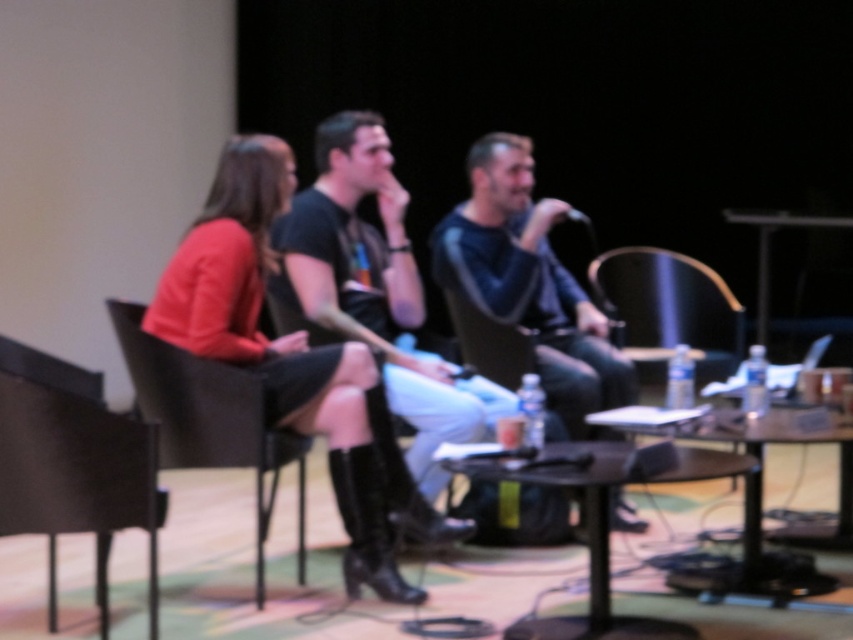
Based on the scene description, where is the wooden round table at center located in terms of its 2D coordinates?

The wooden round table at center is located at the 2D coordinates of point (759, 506).

You are organizing a small event and need to seat two guests. You have a black wicker chair at left and a wooden table at right available. Which object can accommodate a larger guest?

The black wicker chair at left has a larger size compared to the wooden table at right, so it can accommodate a larger guest.

You are an event organizer setting up a stage for a panel discussion. You have two items to place on the stage according to the scene description. The items are the black matte shirt at center and the black leather chair at left. Based on the scene, which item is positioned higher up on the stage?

The black matte shirt at center is located above the black leather chair at left, so the black matte shirt at center is positioned higher up on the stage.